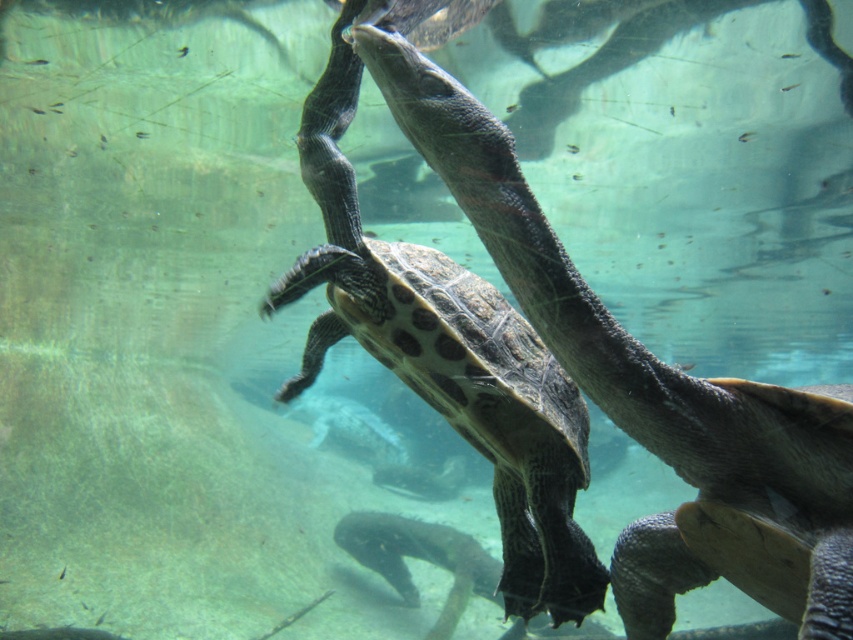
Can you confirm if leathery greenish-brown tortoise at center is taller than leathery green tortoise at center?

No.

Who is positioned more to the right, leathery greenish-brown tortoise at center or leathery green tortoise at center?

leathery greenish-brown tortoise at center

Image resolution: width=853 pixels, height=640 pixels. I want to click on leathery greenish-brown tortoise at center, so click(647, 385).